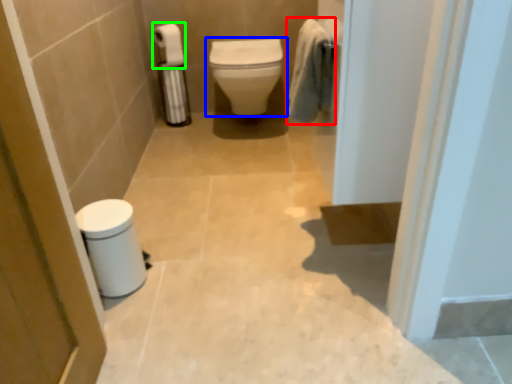
Question: Which object is positioned closest to bath towel (highlighted by a red box)? Select from toilet (highlighted by a blue box) and toilet paper (highlighted by a green box).

Choices:
 (A) toilet
 (B) toilet paper

Answer: (A)